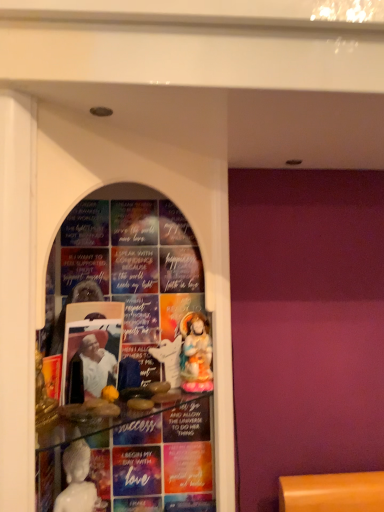
What do you see at coordinates (123, 361) in the screenshot? The height and width of the screenshot is (512, 384). I see `transparent glass shelf at center` at bounding box center [123, 361].

Image resolution: width=384 pixels, height=512 pixels. What do you see at coordinates (169, 359) in the screenshot?
I see `white glossy statue at center` at bounding box center [169, 359].

Identify the location of transparent glass shelf at center. This screenshot has height=512, width=384. (123, 361).

Is porcelain statue at center, placed as the 1th person when sorted from right to left, beside white glossy statue at center?

Yes, porcelain statue at center, placed as the 1th person when sorted from right to left, is with white glossy statue at center.

Is porcelain statue at center, which appears as the 1th person when viewed from the back, further to camera compared to white glossy statue at center?

No, it is not.

Which of these two, porcelain statue at center, placed as the 1th person when sorted from right to left, or white glossy statue at center, stands shorter?

white glossy statue at center.

Which is less distant, [192,317] or [172,369]?

Point [192,317] is positioned farther from the camera compared to point [172,369].

From the image's perspective, is transparent glass shelf at center positioned above or below white glossy statue at center, the second person in the right-to-left sequence?

From the image's perspective, transparent glass shelf at center appears above white glossy statue at center, the second person in the right-to-left sequence.

From a real-world perspective, is transparent glass shelf at center over white glossy statue at center, the first person in the front-to-back sequence?

Correct, in the physical world, transparent glass shelf at center is higher than white glossy statue at center, the first person in the front-to-back sequence.

Considering the relative sizes of transparent glass shelf at center and white glossy statue at center, the second person in the right-to-left sequence, in the image provided, is transparent glass shelf at center thinner than white glossy statue at center, the second person in the right-to-left sequence,?

No.

In the scene shown: Is transparent glass shelf at center facing away from white glossy statue at center, which is the second person from back to front?

That's right, transparent glass shelf at center is facing away from white glossy statue at center, which is the second person from back to front.

Consider the image. Is white glossy statue at center surrounding porcelain statue at center, which appears as the 1th person when viewed from the back?

No, porcelain statue at center, which appears as the 1th person when viewed from the back, is not inside white glossy statue at center.

Which object is further away from the camera taking this photo, white glossy statue at center or porcelain statue at center, placed as the 1th person when sorted from right to left?

white glossy statue at center is further away from the camera.

Is point (159, 350) in front of point (182, 382)?

No, it is behind (182, 382).

Between white glossy statue at center and porcelain statue at center, placed as the 1th person when sorted from right to left, which one has less height?

white glossy statue at center is shorter.

Visually, is porcelain statue at center, the second person viewed from the front, positioned to the left or to the right of white glossy statue at center, the second person in the right-to-left sequence?

Clearly, porcelain statue at center, the second person viewed from the front, is on the right of white glossy statue at center, the second person in the right-to-left sequence, in the image.

Is porcelain statue at center, placed as the 1th person when sorted from right to left, facing towards white glossy statue at center, which is the second person from back to front?

No, porcelain statue at center, placed as the 1th person when sorted from right to left, is not turned towards white glossy statue at center, which is the second person from back to front.

Is porcelain statue at center, the second person positioned from the left, placed right next to white glossy statue at center, the second person in the right-to-left sequence?

No, porcelain statue at center, the second person positioned from the left, is not touching white glossy statue at center, the second person in the right-to-left sequence.

Does porcelain statue at center, which appears as the 1th person when viewed from the back, have a lesser height compared to white glossy statue at center, the first person viewed from the left?

Incorrect, the height of porcelain statue at center, which appears as the 1th person when viewed from the back, does not fall short of that of white glossy statue at center, the first person viewed from the left.

Based on the photo, considering the relative sizes of white glossy statue at center, the second person in the right-to-left sequence, and porcelain statue at center, which appears as the 1th person when viewed from the back, in the image provided, is white glossy statue at center, the second person in the right-to-left sequence, bigger than porcelain statue at center, which appears as the 1th person when viewed from the back,?

Correct, white glossy statue at center, the second person in the right-to-left sequence, is larger in size than porcelain statue at center, which appears as the 1th person when viewed from the back.

Is porcelain statue at center, the second person positioned from the left, inside white glossy statue at center, the second person in the right-to-left sequence?

No, porcelain statue at center, the second person positioned from the left, is not inside white glossy statue at center, the second person in the right-to-left sequence.

Is point (106, 366) positioned in front of point (209, 384)?

Yes.

Is white glossy statue at center, the first person viewed from the left, not near porcelain statue at center, which appears as the 1th person when viewed from the back?

They are positioned close to each other.

From the picture: Is white glossy statue at center, the second person in the right-to-left sequence, inside the boundaries of white glossy statue at center, or outside?

white glossy statue at center, the second person in the right-to-left sequence, is not enclosed by white glossy statue at center.

Can you see white glossy statue at center, the first person viewed from the left, touching white glossy statue at center?

No, white glossy statue at center, the first person viewed from the left, is not touching white glossy statue at center.

Looking at this image, considering the relative sizes of white glossy statue at center, the second person in the right-to-left sequence, and white glossy statue at center in the image provided, is white glossy statue at center, the second person in the right-to-left sequence, shorter than white glossy statue at center?

Incorrect, the height of white glossy statue at center, the second person in the right-to-left sequence, does not fall short of that of white glossy statue at center.

Who is bigger, white glossy statue at center, the first person in the front-to-back sequence, or white glossy statue at center?

With larger size is white glossy statue at center, the first person in the front-to-back sequence.

From the picture: From the image's perspective, between transparent glass shelf at center and white glossy statue at center, who is located below?

white glossy statue at center.

Between point (183, 464) and point (176, 356), which one is positioned behind?

Positioned behind is point (183, 464).

Measure the distance from transparent glass shelf at center to white glossy statue at center.

The distance of transparent glass shelf at center from white glossy statue at center is 6.56 inches.

The width and height of the screenshot is (384, 512). What are the coordinates of `shop window lying on the left of white glossy statue at center` in the screenshot? It's located at (123, 361).

Identify the location of toy behind the porcelain statue at center, which appears as the 1th person when viewed from the back. Image resolution: width=384 pixels, height=512 pixels. (169, 359).

From a real-world perspective, starting from the transparent glass shelf at center, which person is the 2nd one below it? Please provide its 2D coordinates.

[(96, 365)]

Considering their positions, is transparent glass shelf at center positioned closer to white glossy statue at center than white glossy statue at center, the first person in the front-to-back sequence?

The object closer to white glossy statue at center is white glossy statue at center, the first person in the front-to-back sequence.

Which object lies further to the anchor point porcelain statue at center, which appears as the 1th person when viewed from the back, white glossy statue at center or transparent glass shelf at center?

transparent glass shelf at center lies further to porcelain statue at center, which appears as the 1th person when viewed from the back, than the other object.

Estimate the real-world distances between objects in this image. Which object is closer to white glossy statue at center, the first person in the front-to-back sequence, white glossy statue at center or porcelain statue at center, the second person positioned from the left?

The object closer to white glossy statue at center, the first person in the front-to-back sequence, is white glossy statue at center.

Which object lies nearer to the anchor point transparent glass shelf at center, white glossy statue at center or white glossy statue at center, the second person in the right-to-left sequence?

Among the two, white glossy statue at center, the second person in the right-to-left sequence, is located nearer to transparent glass shelf at center.

Estimate the real-world distances between objects in this image. Which object is further from white glossy statue at center, the second person in the right-to-left sequence, transparent glass shelf at center or porcelain statue at center, which appears as the 1th person when viewed from the back?

Based on the image, porcelain statue at center, which appears as the 1th person when viewed from the back, appears to be further to white glossy statue at center, the second person in the right-to-left sequence.

Considering their positions, is white glossy statue at center, the first person viewed from the left, positioned further to transparent glass shelf at center than white glossy statue at center?

white glossy statue at center.

Estimate the real-world distances between objects in this image. Which object is further from porcelain statue at center, which appears as the 1th person when viewed from the back, white glossy statue at center or white glossy statue at center, the second person in the right-to-left sequence?

white glossy statue at center, the second person in the right-to-left sequence, is positioned further to the anchor porcelain statue at center, which appears as the 1th person when viewed from the back.

Considering their positions, is white glossy statue at center, which is the second person from back to front, positioned further to white glossy statue at center than transparent glass shelf at center?

The object further to white glossy statue at center is transparent glass shelf at center.

What are the coordinates of `toy located between white glossy statue at center, the second person in the right-to-left sequence, and porcelain statue at center, the second person viewed from the front, in the left-right direction` in the screenshot? It's located at (169, 359).

At what (x,y) coordinates should I click in order to perform the action: click on person between transparent glass shelf at center and porcelain statue at center, placed as the 1th person when sorted from right to left, along the z-axis. Please return your answer as a coordinate pair (x, y). Looking at the image, I should click on (96, 365).